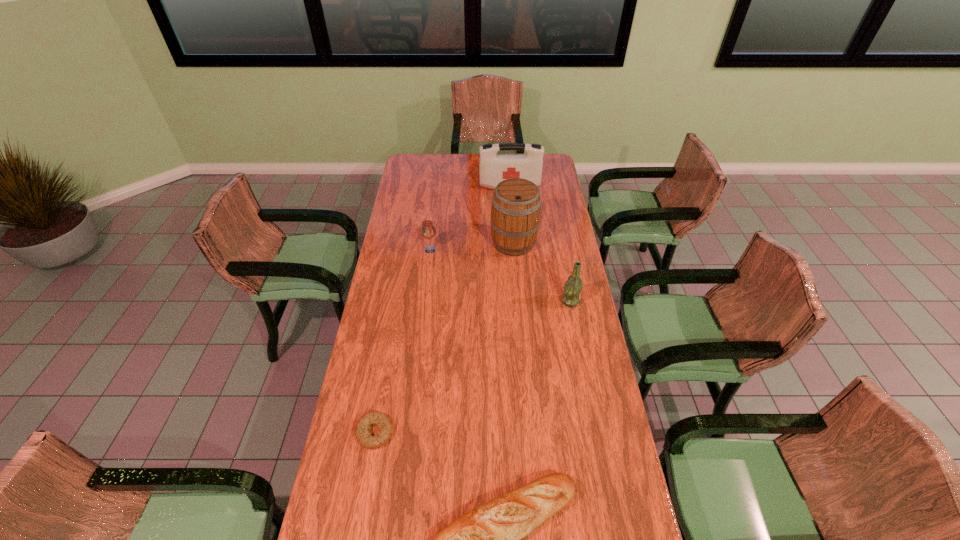
Find the location of `cider`. cider is located at coordinates (515, 213).

The width and height of the screenshot is (960, 540). I want to click on the first-aid kit, so click(x=493, y=168).

The height and width of the screenshot is (540, 960). In order to click on the fourth shortest object in this screenshot , I will do `click(573, 286)`.

The height and width of the screenshot is (540, 960). In order to click on beer bottle in this screenshot , I will do `click(573, 286)`.

The width and height of the screenshot is (960, 540). What are the coordinates of `wineglass` in the screenshot? It's located at (428, 230).

You are a GUI agent. You are given a task and a screenshot of the screen. Output one action in this format:
    pyautogui.click(x=<x>, y=<y>)
    Task: Click on the fifth object from right to left
    The height and width of the screenshot is (540, 960).
    Given the screenshot: What is the action you would take?
    pyautogui.click(x=428, y=230)

You are a GUI agent. You are given a task and a screenshot of the screen. Output one action in this format:
    pyautogui.click(x=<x>, y=<y>)
    Task: Click on the leftmost object
    
    Given the screenshot: What is the action you would take?
    pyautogui.click(x=362, y=430)

Identify the location of the shortest object. Image resolution: width=960 pixels, height=540 pixels. pyautogui.click(x=362, y=430).

You are a GUI agent. You are given a task and a screenshot of the screen. Output one action in this format:
    pyautogui.click(x=<x>, y=<y>)
    Task: Click on the free region located 0.110m on the back of the tallest object
    This screenshot has height=540, width=960.
    Given the screenshot: What is the action you would take?
    pyautogui.click(x=512, y=215)

Where is `free space located on the front side of the farthest object`? The image size is (960, 540). free space located on the front side of the farthest object is located at coordinates 514,232.